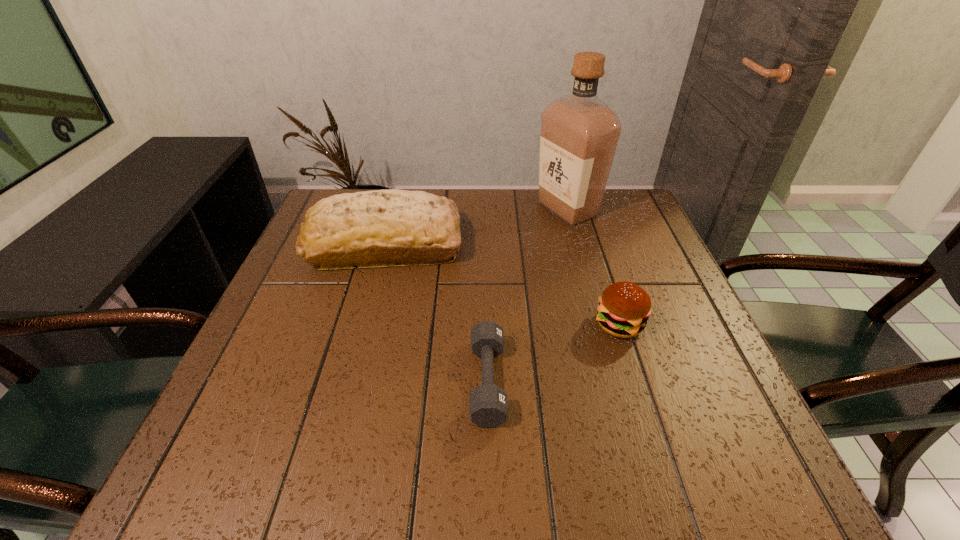
Locate an element on the screen. The width and height of the screenshot is (960, 540). vacant space located on the left of the second shortest object is located at coordinates (462, 324).

Find the location of a particular element. The height and width of the screenshot is (540, 960). free space located 0.050m on the left of the second object from left to right is located at coordinates (444, 381).

The width and height of the screenshot is (960, 540). I want to click on liquor present at the far edge, so click(x=579, y=135).

The image size is (960, 540). Find the location of `bread at the far edge`. bread at the far edge is located at coordinates (380, 228).

Find the location of a particular element. The image size is (960, 540). object located in the left edge section of the desktop is located at coordinates (380, 228).

Where is `liquor positioned at the right edge`? liquor positioned at the right edge is located at coordinates (579, 135).

Find the location of a particular element. Image resolution: width=960 pixels, height=540 pixels. hamburger located at the right edge is located at coordinates (624, 307).

Find the location of a particular element. object at the far left corner is located at coordinates (380, 228).

Find the location of `object that is at the far right corner`. object that is at the far right corner is located at coordinates tap(579, 135).

The width and height of the screenshot is (960, 540). I want to click on vacant space at the far edge of the desktop, so click(x=540, y=233).